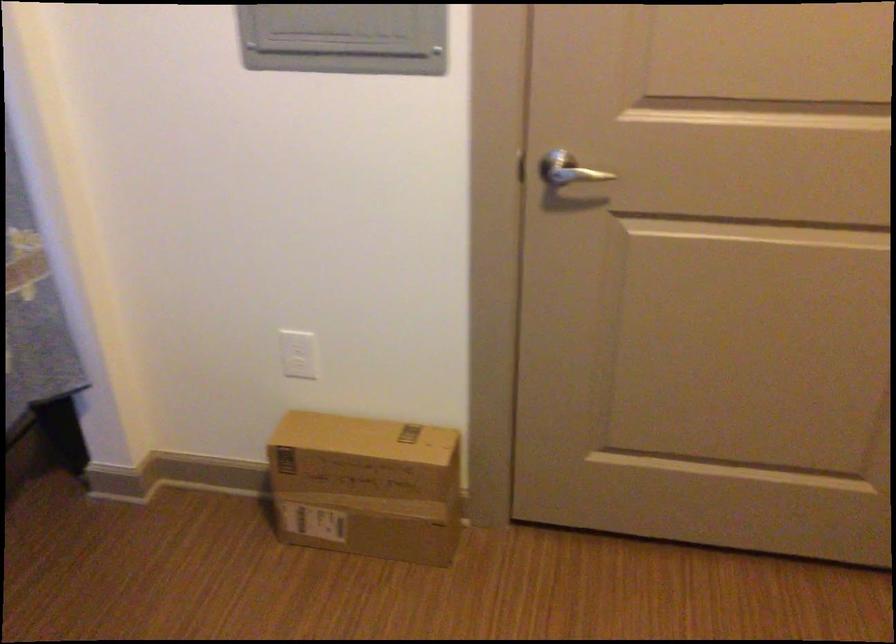
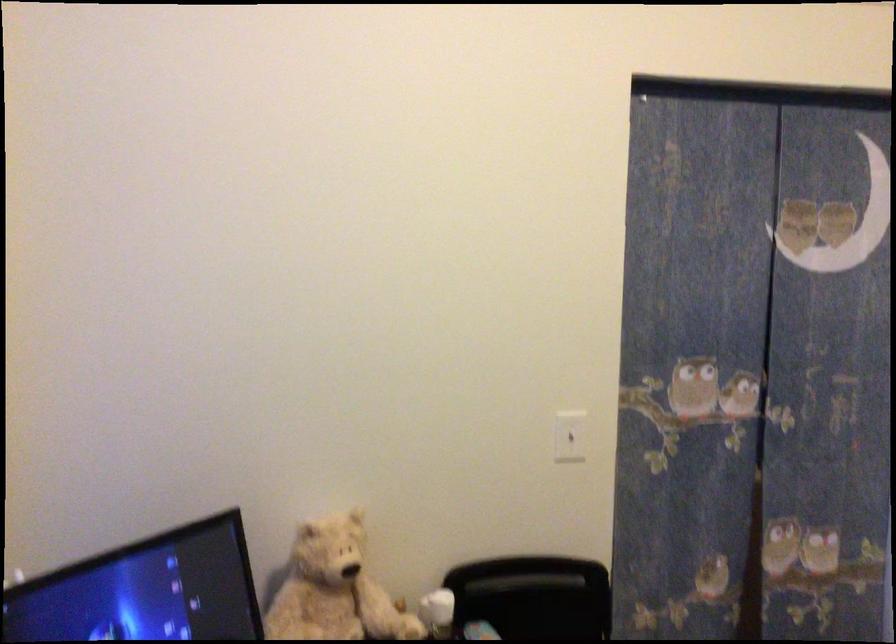
Question: The camera is either moving clockwise (left) or counter-clockwise (right) around the object. The first image is from the beginning of the video and the second image is from the end. Is the camera moving left or right when shooting the video?

Choices:
 (A) Left
 (B) Right

Answer: (B)